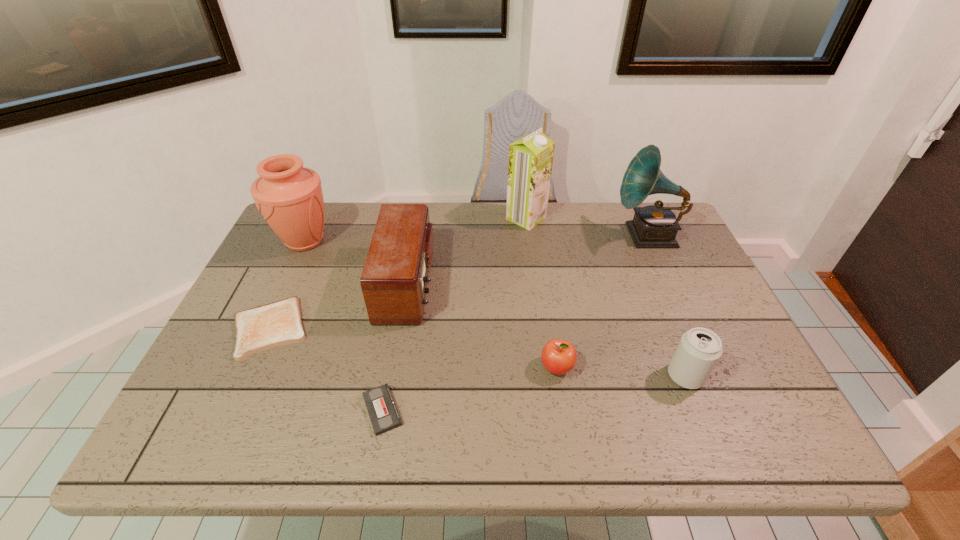
Image resolution: width=960 pixels, height=540 pixels. In order to click on free region that satisfies the following two spatial constraints: 1. on the front side of the apple; 2. on the left side of the soya milk in this screenshot , I will do `click(545, 367)`.